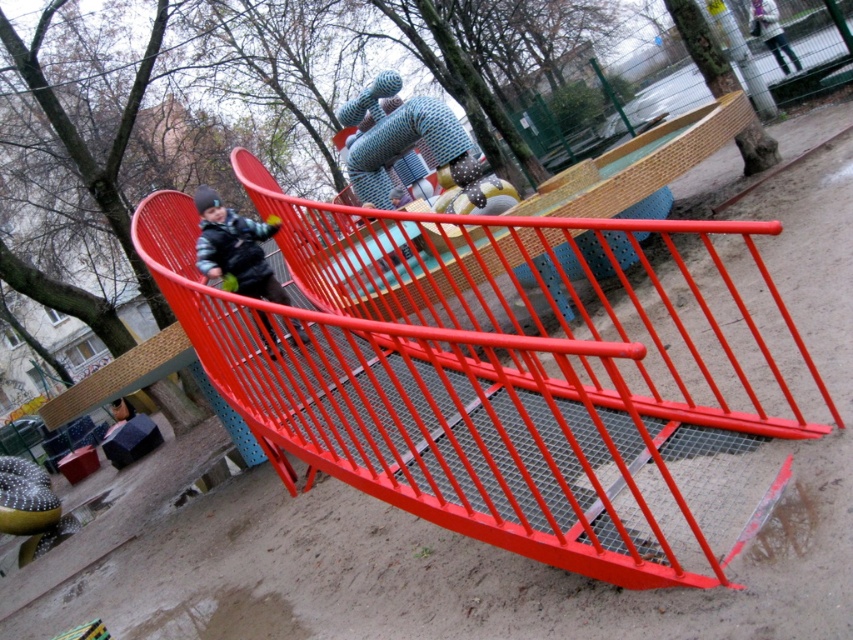
Question: Which object appears farthest from the camera in this image?

Choices:
 (A) matte black jacket at left
 (B) metallic red slide at center

Answer: (A)

Question: In this image, where is metallic red slide at center located relative to matte black jacket at left?

Choices:
 (A) right
 (B) left

Answer: (A)

Question: Which of the following is the farthest from the observer?

Choices:
 (A) (204, 218)
 (B) (380, 452)

Answer: (A)

Question: Is metallic red slide at center to the right of matte black jacket at left from the viewer's perspective?

Choices:
 (A) yes
 (B) no

Answer: (A)

Question: Is metallic red slide at center to the right of matte black jacket at left from the viewer's perspective?

Choices:
 (A) yes
 (B) no

Answer: (A)